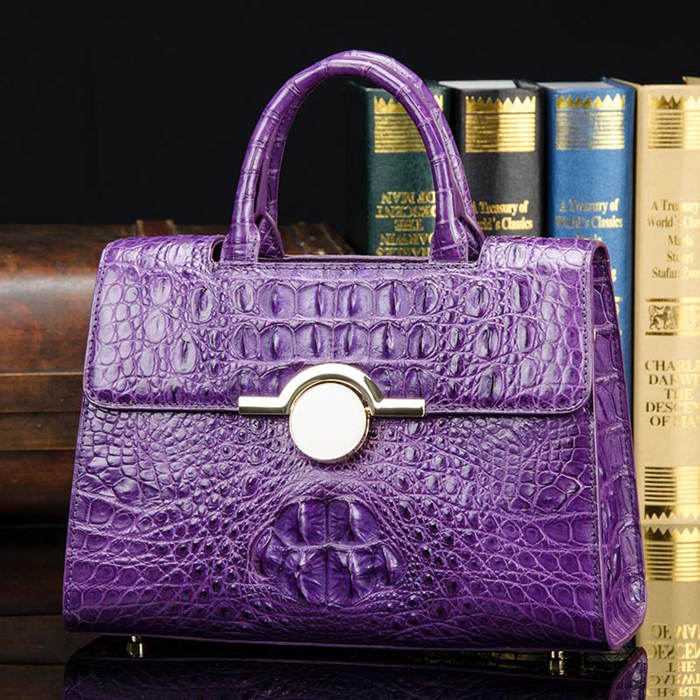
At what (x,y) coordinates should I click in order to perform the action: click on wooden box. Please return your answer as a coordinate pair (x, y). This screenshot has height=700, width=700. Looking at the image, I should click on (47, 316).